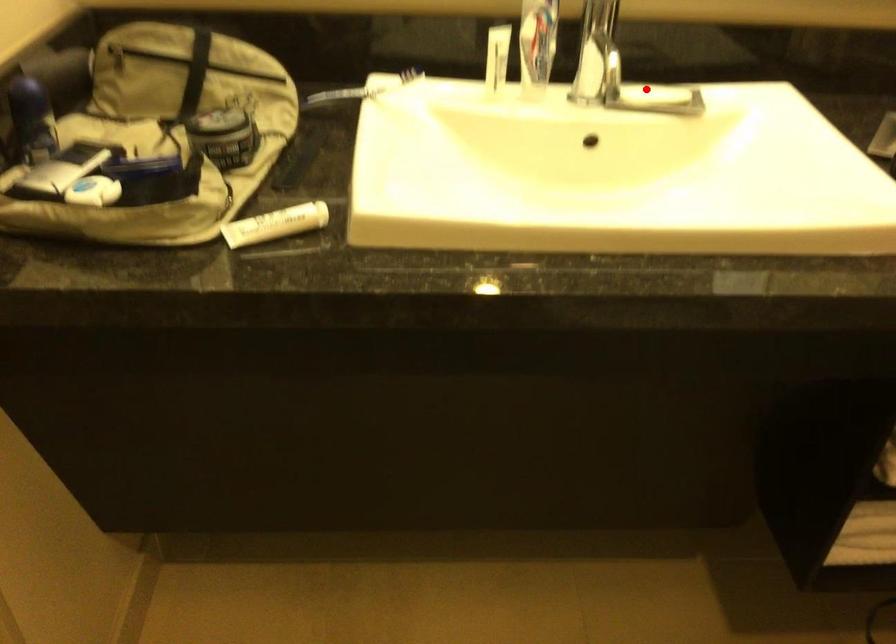
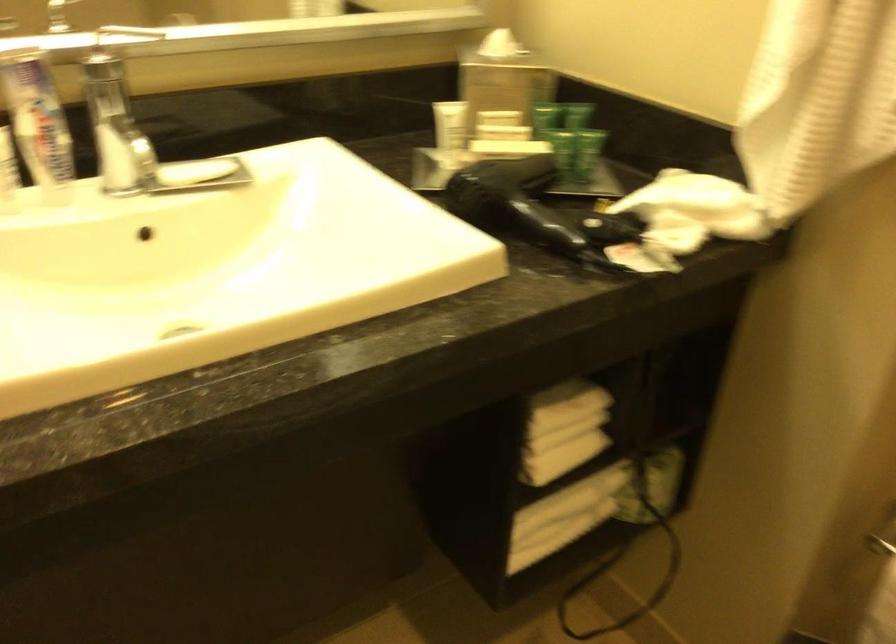
Find the pixel in the second image that matches the highlighted location in the first image.

(195, 171)